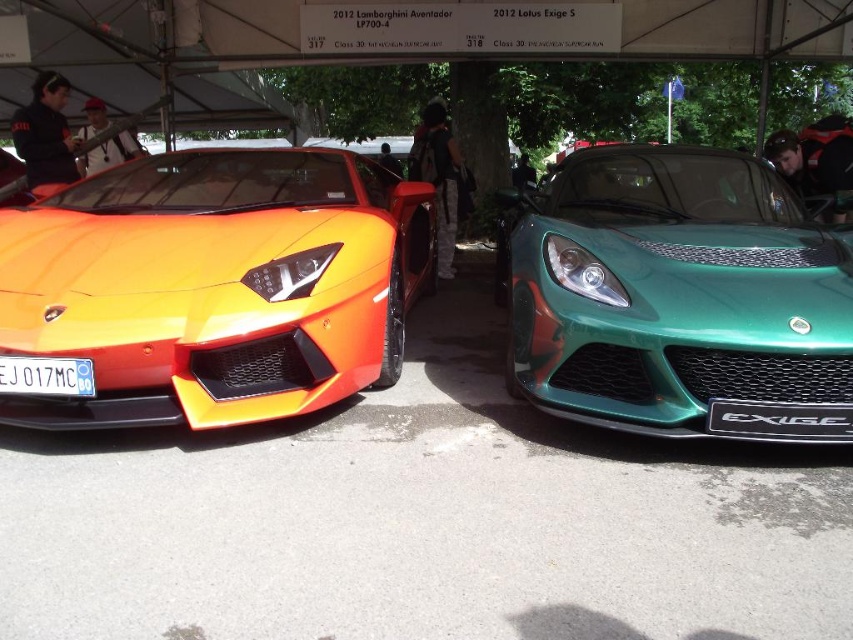
You are standing at the front of the canopy where the two sports cars are displayed. You notice two specific points marked on the ground. The first point is at coordinate point (x=558, y=384) and the second is at point (x=9, y=381). If you want to walk from the first point to the second point, which direction should you move relative to the canopy?

To move from point (x=558, y=384) to point (x=9, y=381), you should move downward because point (x=558, y=384) is behind point (x=9, y=381), meaning it is located further back, and the second point is in front closer to the front of the canopy.